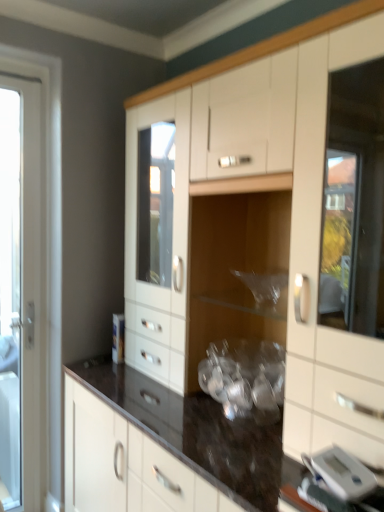
Image resolution: width=384 pixels, height=512 pixels. What do you see at coordinates (263, 221) in the screenshot? I see `white glossy cabinet at center` at bounding box center [263, 221].

Where is `white glossy door at left`? This screenshot has height=512, width=384. white glossy door at left is located at coordinates click(x=22, y=292).

This screenshot has width=384, height=512. In order to click on silver metallic digital clock at lower right in this screenshot , I will do `click(341, 473)`.

Is silver metallic digital clock at lower right placed right next to white glossy door at left?

No.

Based on the photo, is silver metallic digital clock at lower right completely or partially outside of white glossy door at left?

silver metallic digital clock at lower right is positioned outside white glossy door at left.

Is silver metallic digital clock at lower right wider or thinner than white glossy door at left?

Clearly, silver metallic digital clock at lower right has more width compared to white glossy door at left.

Identify the location of appliance below the white glossy door at left (from the image's perspective). This screenshot has height=512, width=384. (341, 473).

Considering the sizes of objects white glossy cabinet at center and silver metallic digital clock at lower right in the image provided, who is shorter, white glossy cabinet at center or silver metallic digital clock at lower right?

silver metallic digital clock at lower right.

From the image's perspective, is white glossy cabinet at center above silver metallic digital clock at lower right?

Yes.

Is the surface of white glossy cabinet at center in direct contact with silver metallic digital clock at lower right?

white glossy cabinet at center is not next to silver metallic digital clock at lower right, and they're not touching.

Is the position of white glossy cabinet at center more distant than that of silver metallic digital clock at lower right?

No, white glossy cabinet at center is closer to the viewer.

From the image's perspective, which one is positioned higher, white glossy door at left or silver metallic digital clock at lower right?

From the image's view, white glossy door at left is above.

Is white glossy door at left positioned with its back to silver metallic digital clock at lower right?

That's not correct — white glossy door at left is not looking away from silver metallic digital clock at lower right.

Is white glossy door at left next to silver metallic digital clock at lower right?

No, white glossy door at left is not making contact with silver metallic digital clock at lower right.

Does white glossy door at left have a lesser height compared to silver metallic digital clock at lower right?

No.

Can you confirm if silver metallic digital clock at lower right is shorter than white glossy cabinet at center?

Indeed, silver metallic digital clock at lower right has a lesser height compared to white glossy cabinet at center.

From a real-world perspective, relative to white glossy cabinet at center, is silver metallic digital clock at lower right vertically above or below?

silver metallic digital clock at lower right is below white glossy cabinet at center.

Locate an element on the screen. The height and width of the screenshot is (512, 384). cabinetry above the silver metallic digital clock at lower right (from a real-world perspective) is located at coordinates (263, 221).

Is white glossy cabinet at center spatially inside white glossy door at left, or outside of it?

The correct answer is: outside.

You are a GUI agent. You are given a task and a screenshot of the screen. Output one action in this format:
    pyautogui.click(x=<x>, y=<y>)
    Task: Click on the cabinetry on the right of white glossy door at left
    
    Given the screenshot: What is the action you would take?
    pyautogui.click(x=263, y=221)

Is white glossy cabinet at center to the left of white glossy door at left from the viewer's perspective?

No, white glossy cabinet at center is not to the left of white glossy door at left.

From a real-world perspective, is white glossy door at left beneath white glossy cabinet at center?

Actually, white glossy door at left is physically above white glossy cabinet at center in the real world.

Considering the sizes of objects white glossy door at left and white glossy cabinet at center in the image provided, who is thinner, white glossy door at left or white glossy cabinet at center?

white glossy door at left is thinner.

Which object is positioned more to the left, white glossy door at left or white glossy cabinet at center?

white glossy door at left is more to the left.

Which is correct: white glossy door at left is inside white glossy cabinet at center, or outside of it?

The correct answer is: outside.

The image size is (384, 512). In order to click on appliance located in front of the white glossy door at left in this screenshot , I will do `click(341, 473)`.

The height and width of the screenshot is (512, 384). In order to click on appliance that is below the white glossy cabinet at center (from the image's perspective) in this screenshot , I will do `click(341, 473)`.

Based on their spatial positions, is white glossy door at left or white glossy cabinet at center closer to silver metallic digital clock at lower right?

white glossy cabinet at center lies closer to silver metallic digital clock at lower right than the other object.

Looking at the image, which one is located closer to silver metallic digital clock at lower right, white glossy cabinet at center or white glossy door at left?

Based on the image, white glossy cabinet at center appears to be nearer to silver metallic digital clock at lower right.

From the image, which object appears to be farther from white glossy cabinet at center, silver metallic digital clock at lower right or white glossy door at left?

white glossy door at left is positioned further to the anchor white glossy cabinet at center.

When comparing their distances from white glossy cabinet at center, does white glossy door at left or silver metallic digital clock at lower right seem closer?

Based on the image, silver metallic digital clock at lower right appears to be nearer to white glossy cabinet at center.

Based on their spatial positions, is white glossy cabinet at center or silver metallic digital clock at lower right further from white glossy door at left?

silver metallic digital clock at lower right is positioned further to the anchor white glossy door at left.

Considering their positions, is silver metallic digital clock at lower right positioned further to white glossy door at left than white glossy cabinet at center?

Among the two, silver metallic digital clock at lower right is located further to white glossy door at left.

Find the location of a particular element. The image size is (384, 512). appliance between white glossy cabinet at center and white glossy door at left in the front-back direction is located at coordinates (341, 473).